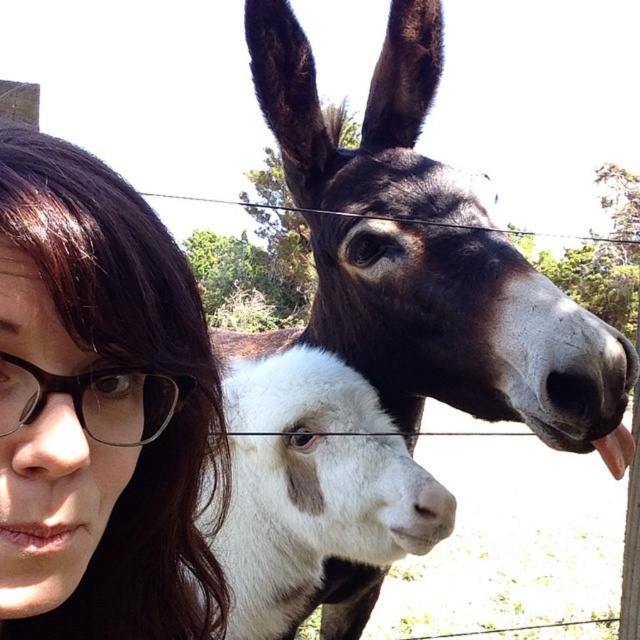
Is brown hair at left to the right of black plastic glasses at left from the viewer's perspective?

Incorrect, brown hair at left is not on the right side of black plastic glasses at left.

Which is behind, point (10, 390) or point (156, 384)?

Positioned behind is point (156, 384).

Find the location of `brown hair at left`. brown hair at left is located at coordinates (99, 408).

Between point (154, 401) and point (278, 113), which one is positioned behind?

The point (278, 113) is behind.

Image resolution: width=640 pixels, height=640 pixels. I want to click on brown hair at left, so click(99, 408).

Is point (147, 355) positioned before point (365, 225)?

Yes, it is in front of point (365, 225).

Identify the location of brown hair at left. click(99, 408).

Can you confirm if black glossy donkey at upper center is bigger than black plastic glasses at left?

Yes.

Who is more forward, (369, 342) or (140, 442)?

Point (140, 442) is in front.

What are the coordinates of `black glossy donkey at upper center` in the screenshot? It's located at (426, 257).